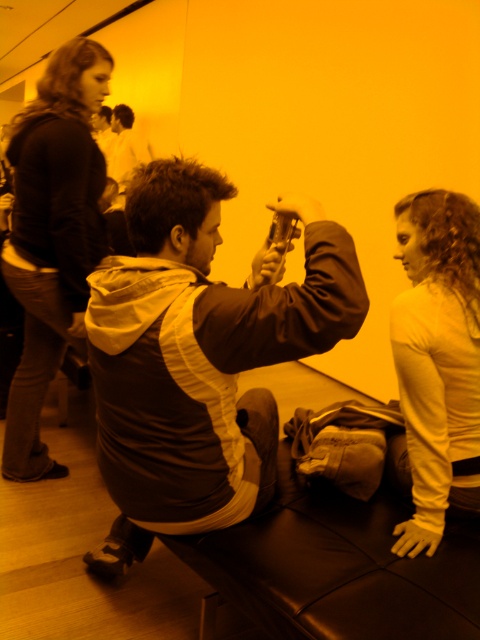
How distant is matte brown jacket at center from dark brown leather jacket at upper left?

The distance of matte brown jacket at center from dark brown leather jacket at upper left is 86.98 centimeters.

Between matte brown jacket at center and dark brown leather jacket at upper left, which one has more height?

With more height is dark brown leather jacket at upper left.

Is point (208, 529) positioned after point (27, 276)?

No, it is not.

I want to click on matte brown jacket at center, so click(200, 356).

Describe the element at coordinates (52, 237) in the screenshot. I see `dark brown leather jacket at upper left` at that location.

Can you confirm if dark brown leather jacket at upper left is thinner than white long-sleeved shirt at right?

Incorrect, dark brown leather jacket at upper left's width is not less than white long-sleeved shirt at right's.

Which is behind, point (36, 460) or point (456, 470)?

The point (36, 460) is behind.

The image size is (480, 640). What are the coordinates of `dark brown leather jacket at upper left` in the screenshot? It's located at (52, 237).

Looking at this image, between matte brown jacket at center and white long-sleeved shirt at right, which one has less height?

white long-sleeved shirt at right

Is matte brown jacket at center in front of white long-sleeved shirt at right?

Yes, matte brown jacket at center is closer to the viewer.

Which is in front, point (248, 323) or point (460, 358)?

Point (248, 323)

This screenshot has height=640, width=480. I want to click on matte brown jacket at center, so click(200, 356).